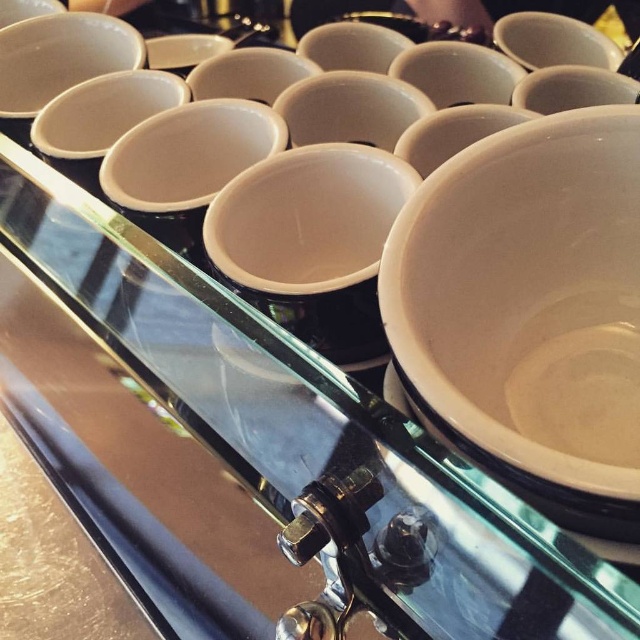
Between white matte bowl at center and white glossy bowl at upper left, which one appears on the left side from the viewer's perspective?

From the viewer's perspective, white glossy bowl at upper left appears more on the left side.

Which is more to the right, white matte bowl at center or white glossy bowl at upper left?

From the viewer's perspective, white matte bowl at center appears more on the right side.

Does point (477, 365) come closer to viewer compared to point (76, 28)?

That is True.

I want to click on white matte bowl at center, so click(529, 296).

Where is `white glossy bowl at upper left`? This screenshot has height=640, width=640. white glossy bowl at upper left is located at coordinates click(60, 56).

Which is in front, point (83, 12) or point (624, 532)?

Positioned in front is point (624, 532).

Which is in front, point (49, 29) or point (534, 500)?

Point (534, 500)

The width and height of the screenshot is (640, 640). Identify the location of white glossy bowl at upper left. 60,56.

Which is below, white matte bowl at center or white glossy saucer at center?

white glossy saucer at center

Is point (561, 298) closer to camera compared to point (560, 488)?

No, (561, 298) is further to viewer.

This screenshot has width=640, height=640. What do you see at coordinates (529, 296) in the screenshot?
I see `white matte bowl at center` at bounding box center [529, 296].

Where is `white matte bowl at center`? white matte bowl at center is located at coordinates (529, 296).